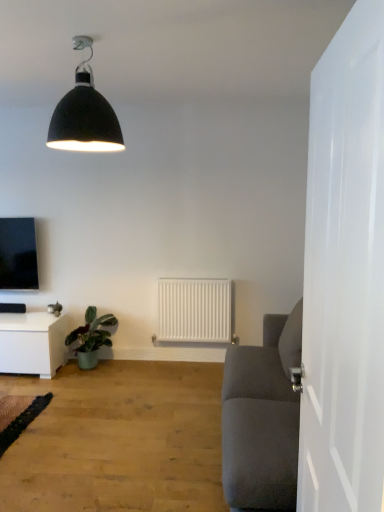
Question: Is matte black tv at upper left to the left or to the right of white glossy table at lower left in the image?

Choices:
 (A) right
 (B) left

Answer: (B)

Question: From a real-world perspective, is matte black tv at upper left positioned above or below white glossy table at lower left?

Choices:
 (A) below
 (B) above

Answer: (B)

Question: Which of these objects is positioned closest to the green glossy plant at lower left?

Choices:
 (A) white glossy table at lower left
 (B) matte black tv at upper left
 (C) matte black lampshade at upper center
 (D) white matte radiator at center
 (E) light brown wood floor at lower left

Answer: (A)

Question: Which object is the farthest from the matte black lampshade at upper center?

Choices:
 (A) white glossy table at lower left
 (B) white matte radiator at center
 (C) white glossy door at right
 (D) matte black tv at upper left
 (E) green glossy plant at lower left

Answer: (B)